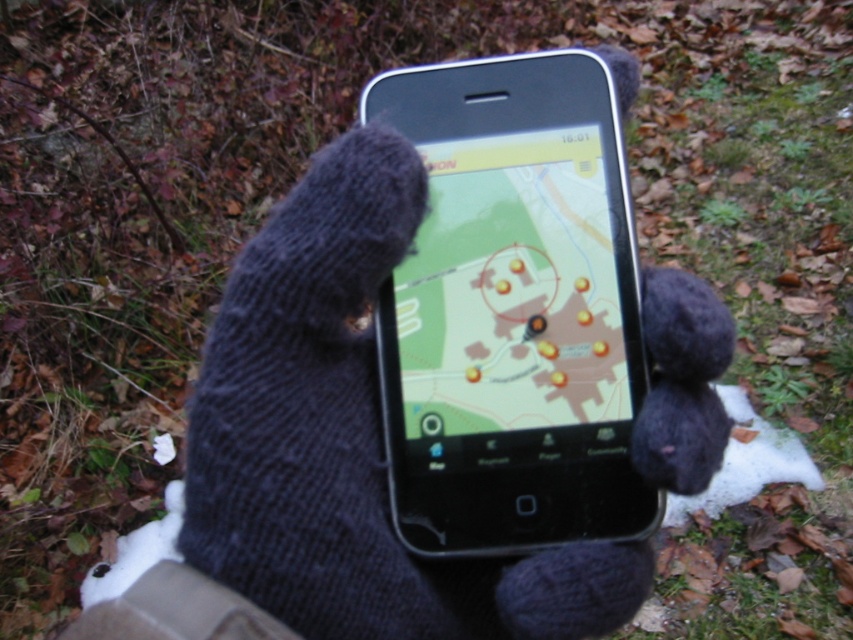
Question: Can you confirm if black glossy smartphone at center is thinner than dark blue knitted glove at center?

Choices:
 (A) no
 (B) yes

Answer: (B)

Question: Which point is farther to the camera?

Choices:
 (A) dark blue knitted glove at center
 (B) black glossy smartphone at center

Answer: (B)

Question: Which object is farther from the camera taking this photo?

Choices:
 (A) black glossy smartphone at center
 (B) dark blue knitted glove at center

Answer: (A)

Question: Can you confirm if black glossy smartphone at center is positioned to the left of dark blue knitted glove at center?

Choices:
 (A) no
 (B) yes

Answer: (A)

Question: Is black glossy smartphone at center smaller than dark blue knitted glove at center?

Choices:
 (A) no
 (B) yes

Answer: (B)

Question: Which of the following is the farthest from the observer?

Choices:
 (A) (247, 300)
 (B) (608, 376)

Answer: (B)